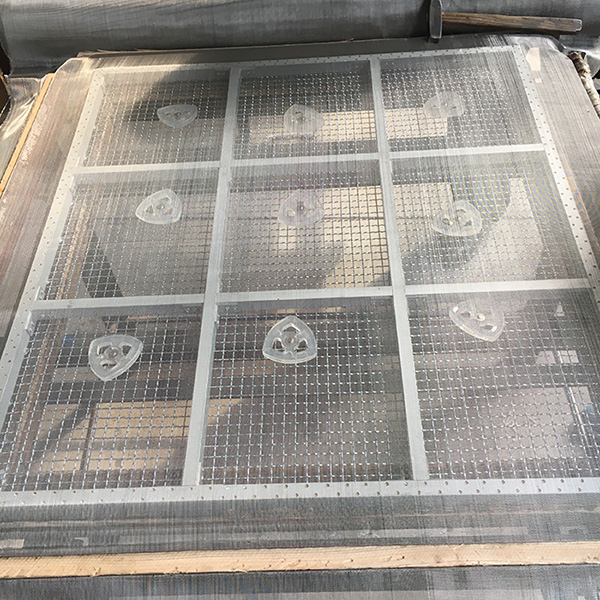
Where is `window frame border`? window frame border is located at coordinates (65, 173), (228, 161), (403, 290), (426, 489), (573, 485), (574, 219), (416, 50), (5, 375), (168, 493).